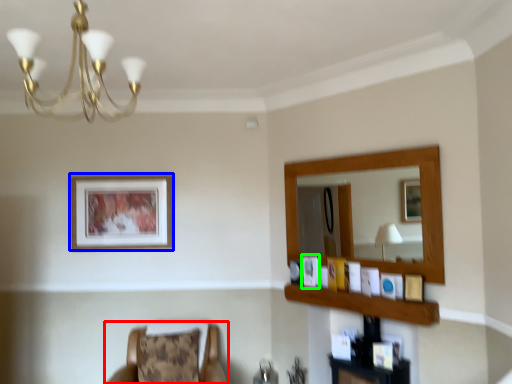
Question: Considering the real-world distances, which object is closest to chair (highlighted by a red box)? picture frame (highlighted by a blue box) or picture frame (highlighted by a green box).

Choices:
 (A) picture frame
 (B) picture frame

Answer: (A)